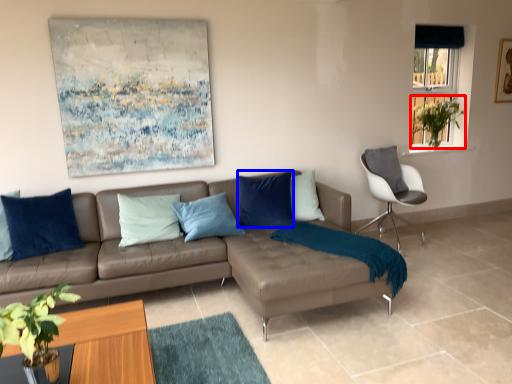
Question: Which object is closer to the camera taking this photo, plant (highlighted by a red box) or pillow (highlighted by a blue box)?

Choices:
 (A) plant
 (B) pillow

Answer: (B)